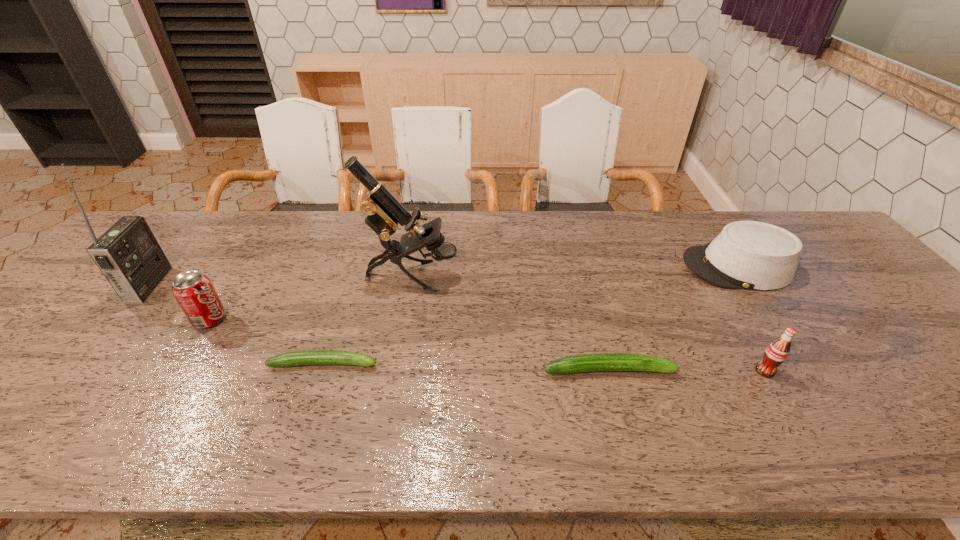
You are a GUI agent. You are given a task and a screenshot of the screen. Output one action in this format:
    pyautogui.click(x=<x>, y=<y>)
    Task: Click on the left zucchini
    The height and width of the screenshot is (540, 960).
    Given the screenshot: What is the action you would take?
    pyautogui.click(x=314, y=357)

You are a GUI agent. You are given a task and a screenshot of the screen. Output one action in this format:
    pyautogui.click(x=<x>, y=<y>)
    Task: Click on the shortest object
    Image resolution: width=960 pixels, height=540 pixels.
    Given the screenshot: What is the action you would take?
    pyautogui.click(x=314, y=357)

At what (x,y) coordinates should I click in order to perform the action: click on the second shortest object. Please return your answer as a coordinate pair (x, y). The height and width of the screenshot is (540, 960). Looking at the image, I should click on (604, 361).

The height and width of the screenshot is (540, 960). In order to click on the taller zucchini in this screenshot , I will do `click(604, 361)`.

You are a GUI agent. You are given a task and a screenshot of the screen. Output one action in this format:
    pyautogui.click(x=<x>, y=<y>)
    Task: Click on the hat
    Image resolution: width=960 pixels, height=540 pixels.
    Given the screenshot: What is the action you would take?
    pyautogui.click(x=753, y=255)

Find the location of a particular element. radio receiver is located at coordinates (128, 254).

Where is `microscope`? The height and width of the screenshot is (540, 960). microscope is located at coordinates (384, 212).

I want to click on the left soda, so click(x=195, y=294).

Find the location of a particular element. the sixth object from right to left is located at coordinates coord(195,294).

The image size is (960, 540). In order to click on the nearer soda in this screenshot , I will do `click(776, 353)`.